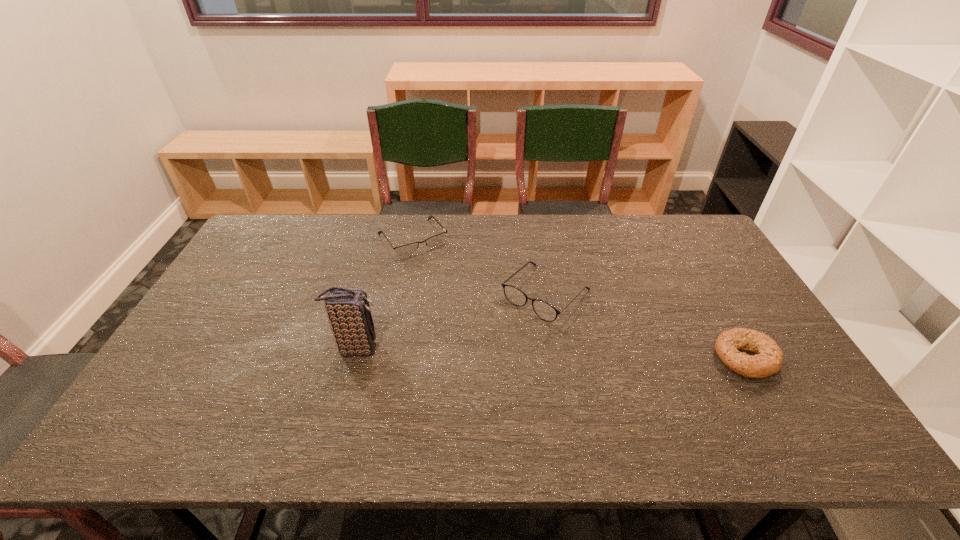
Identify the location of vacant space situated on the front-facing side of the second farthest object. The height and width of the screenshot is (540, 960). (466, 378).

This screenshot has height=540, width=960. Identify the location of free space located 0.160m on the front-facing side of the left spectacles. (449, 285).

The height and width of the screenshot is (540, 960). Find the location of `blank space located 0.400m on the front-facing side of the left spectacles`. blank space located 0.400m on the front-facing side of the left spectacles is located at coordinates (490, 335).

Identify the location of free space located 0.240m on the front-facing side of the left spectacles. (462, 300).

Where is `object that is at the far edge`? object that is at the far edge is located at coordinates (406, 250).

Identify the location of object that is at the near edge. (768, 360).

Image resolution: width=960 pixels, height=540 pixels. Identify the location of object that is at the right edge. (768, 360).

Image resolution: width=960 pixels, height=540 pixels. Find the location of `object at the near right corner`. object at the near right corner is located at coordinates (768, 360).

In the image, there is a desktop. At what (x,y) coordinates should I click in order to perform the action: click on free space at the far edge. Please return your answer as a coordinate pair (x, y). Image resolution: width=960 pixels, height=540 pixels. Looking at the image, I should click on (570, 220).

Image resolution: width=960 pixels, height=540 pixels. What are the coordinates of `free space at the near edge of the desktop` in the screenshot? It's located at (593, 393).